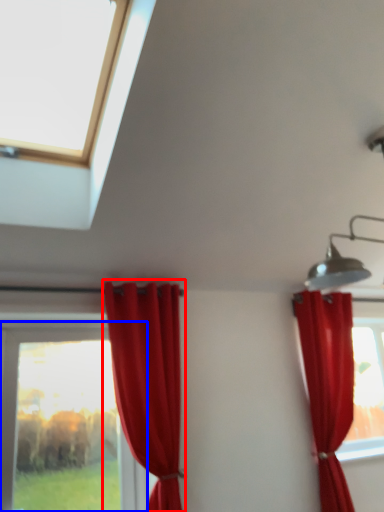
Question: Which of the following is the closest to the observer, curtain (highlighted by a red box) or window (highlighted by a blue box)?

Choices:
 (A) curtain
 (B) window

Answer: (A)